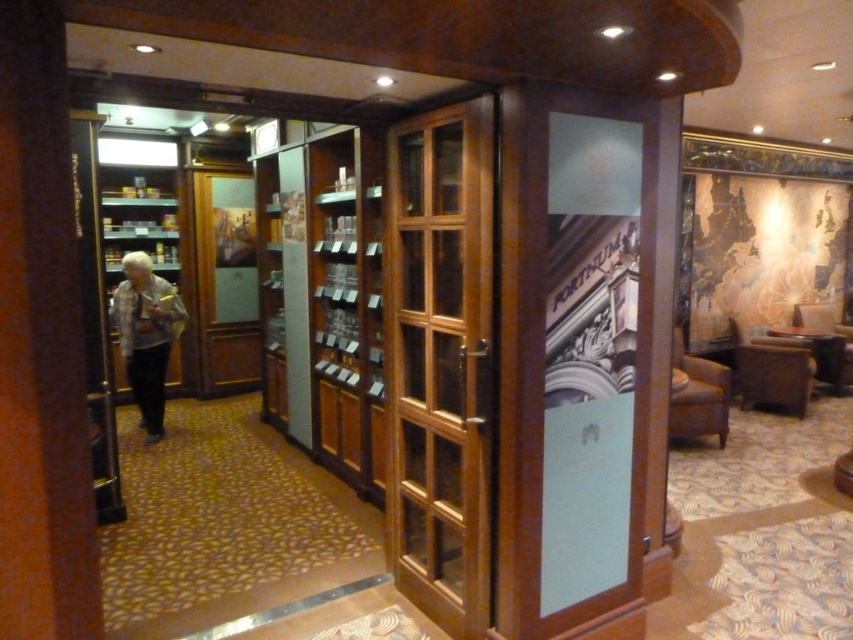
You are a delivery person carrying a large box that is 2 meters long. You are facing the mahogany wood glass door at center. Can you fit through the door without tilting the box sideways?

The mahogany wood glass door at center is 2.33 meters from camera. Since the box is 2 meters long, it is shorter than the distance to the door, so you can fit through the door without tilting the box sideways.

You are a customer entering the store and see the mahogany wood glass door at center and the gray fabric jacket at left. Which object is located to the right of the other?

The mahogany wood glass door at center is positioned on the right side of gray fabric jacket at left, so the mahogany wood glass door at center is to the right of the gray fabric jacket at left.

You are standing in the retail space and want to determine which of the two points, point (436, 179) or point (131, 330), is nearer to you. Based on the scene description, which point is closer?

Point (436, 179) is closer to the viewer than point (131, 330).